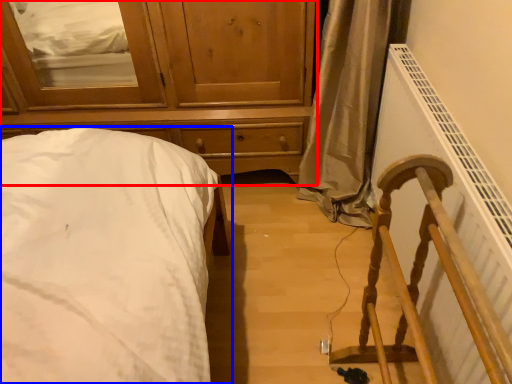
Question: Which point is closer to the camera, chest of drawers (highlighted by a red box) or bed (highlighted by a blue box)?

Choices:
 (A) chest of drawers
 (B) bed

Answer: (B)